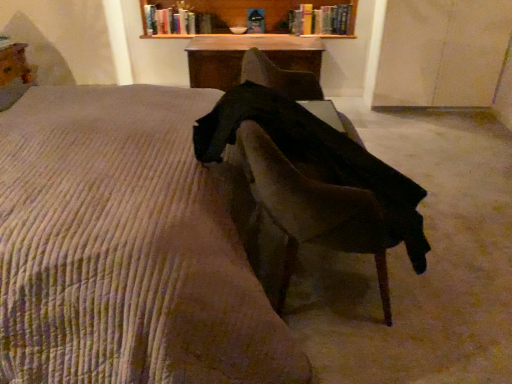
You are a GUI agent. You are given a task and a screenshot of the screen. Output one action in this format:
    pyautogui.click(x=<x>, y=<y>)
    Task: Click on the blank space above hardcover book at upper center, the 2th book viewed from the right (from a real-world perspective)
    
    Given the screenshot: What is the action you would take?
    pyautogui.click(x=183, y=7)